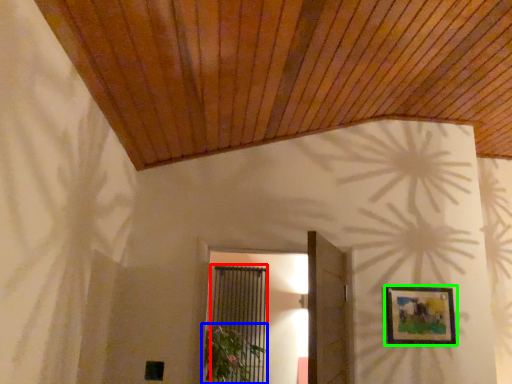
Question: Which object is the closest to the screen door (highlighted by a red box)? Choose among these: plant (highlighted by a blue box) or picture frame (highlighted by a green box).

Choices:
 (A) plant
 (B) picture frame

Answer: (A)